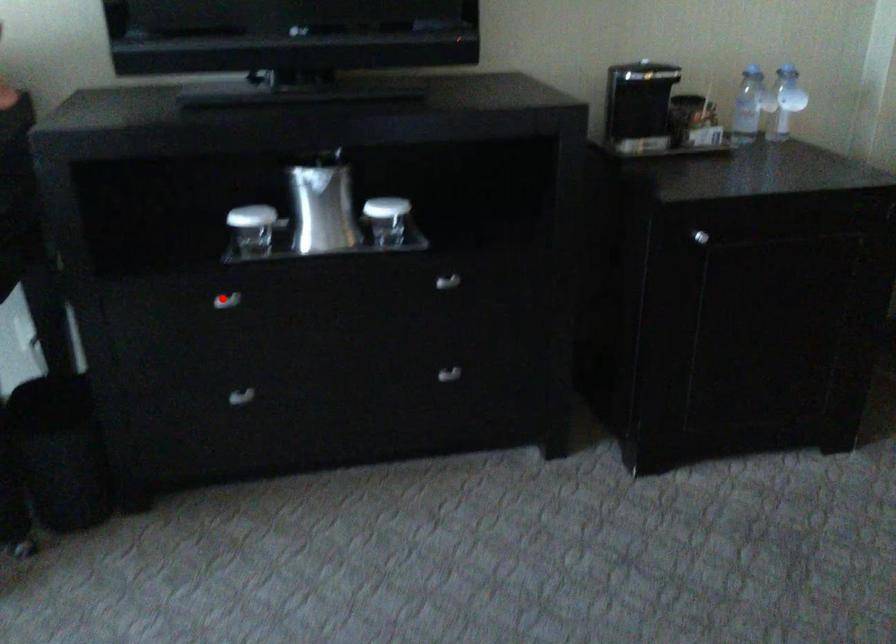
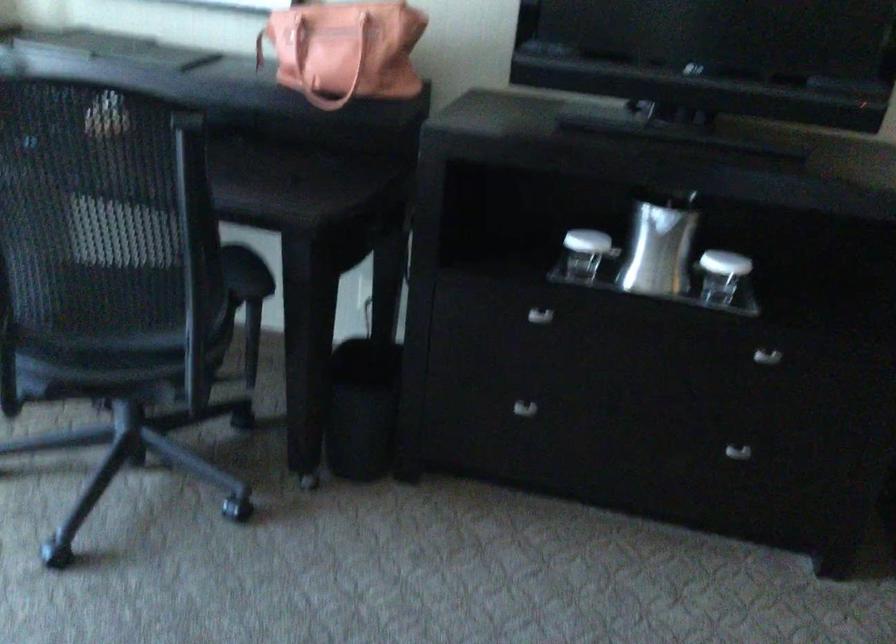
Locate, in the second image, the point that corresponds to the highlighted location in the first image.

(539, 316)